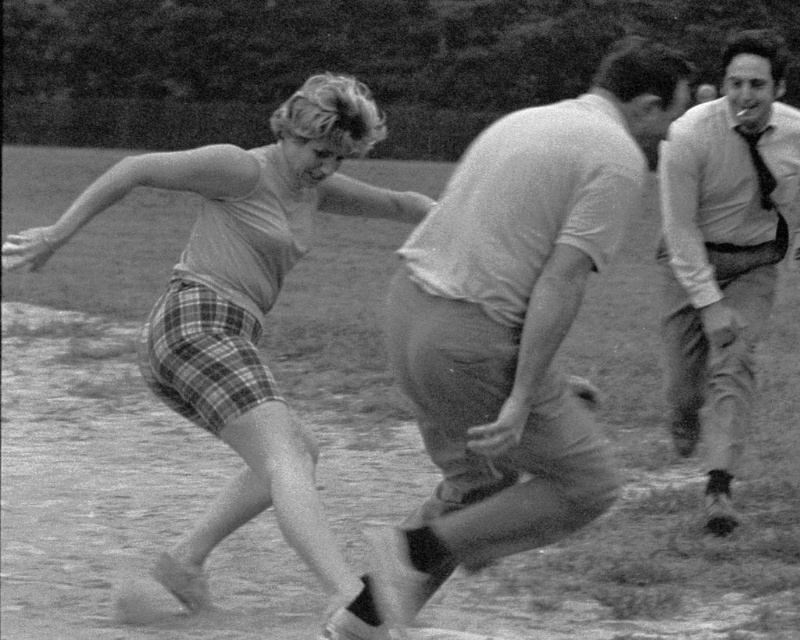
Question: Is plaid shorts at left smaller than light beige shirt at right?

Choices:
 (A) no
 (B) yes

Answer: (B)

Question: Which is farther from the smooth cotton shirt at center?

Choices:
 (A) plaid shorts at left
 (B) light beige shirt at right

Answer: (B)

Question: Which object is the farthest from the plaid shorts at left?

Choices:
 (A) light beige shirt at right
 (B) smooth cotton shirt at center

Answer: (A)

Question: Which point is closer to the camera taking this photo?

Choices:
 (A) (508, 196)
 (B) (302, 493)

Answer: (A)

Question: Is smooth cotton shirt at center above plaid shorts at left?

Choices:
 (A) yes
 (B) no

Answer: (A)

Question: Is plaid shorts at left smaller than light beige shirt at right?

Choices:
 (A) no
 (B) yes

Answer: (B)